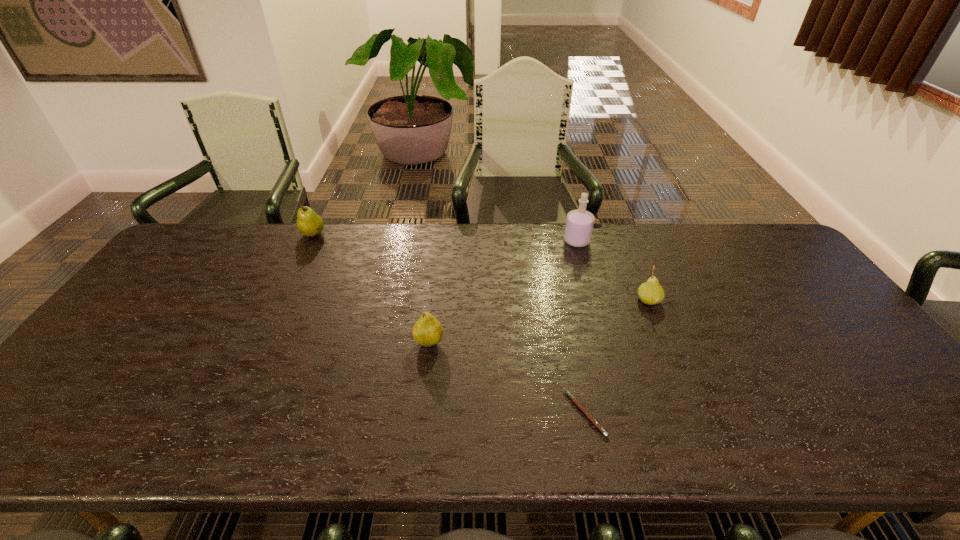
This screenshot has height=540, width=960. Identify the location of free space at the far edge. (635, 252).

What are the coordinates of `blank space at the near edge of the desktop` in the screenshot? It's located at (375, 422).

This screenshot has height=540, width=960. In order to click on free space at the right edge of the desktop in this screenshot , I will do `click(776, 276)`.

Identify the location of vacant region at the far left corner of the desktop. This screenshot has width=960, height=540. (209, 239).

In the image, there is a desktop. At what (x,y) coordinates should I click in order to perform the action: click on blank space at the far right corner. Please return your answer as a coordinate pair (x, y). Looking at the image, I should click on (731, 242).

Locate an element on the screen. Image resolution: width=960 pixels, height=540 pixels. vacant space at the near right corner of the desktop is located at coordinates (888, 443).

You are a GUI agent. You are given a task and a screenshot of the screen. Output one action in this format:
    pyautogui.click(x=<x>, y=<y>)
    Task: Click on the vacant space that is in between the rightmost pear and the second object from right to left
    This screenshot has width=960, height=540.
    Given the screenshot: What is the action you would take?
    (x=612, y=271)

The height and width of the screenshot is (540, 960). Identify the location of vacant area that lies between the perfume and the fourth farthest object. (503, 292).

Find the location of a particular element. vacant area that lies between the farthest pear and the perfume is located at coordinates (444, 238).

This screenshot has width=960, height=540. Find the location of `free space between the pen and the second farthest pear`. free space between the pen and the second farthest pear is located at coordinates (616, 357).